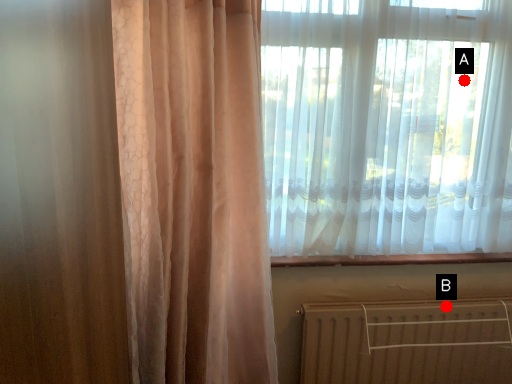
Question: Two points are circled on the image, labeled by A and B beside each circle. Which point is closer to the camera?

Choices:
 (A) A is closer
 (B) B is closer

Answer: (A)